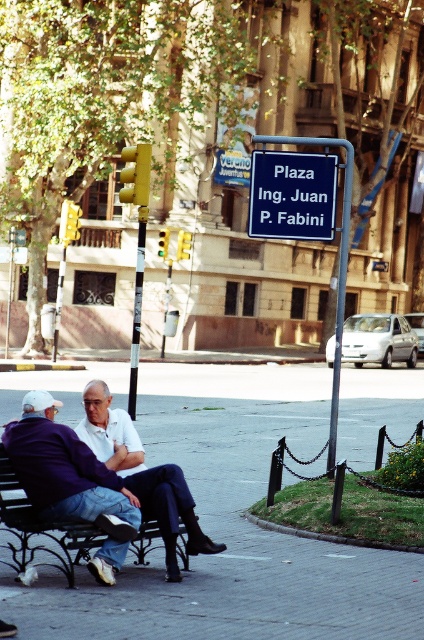
Question: Which object is the closest to the gray concrete pavement at center?

Choices:
 (A) white matte shirt at center
 (B) black wrought iron bench at center
 (C) blue plastic sign at center

Answer: (B)

Question: Which object is the farthest from the white matte shirt at center?

Choices:
 (A) gray concrete pavement at center
 (B) black wrought iron bench at center
 (C) blue plastic sign at center

Answer: (A)

Question: Which of the following is the farthest from the observer?

Choices:
 (A) tap(5, 456)
 (B) tap(272, 170)

Answer: (B)

Question: Can you confirm if gray concrete pavement at center is positioned below blue plastic sign at center?

Choices:
 (A) no
 (B) yes

Answer: (B)

Question: Is gray concrete pavement at center smaller than white matte shirt at center?

Choices:
 (A) no
 (B) yes

Answer: (A)

Question: From the image, what is the correct spatial relationship of white matte shirt at center in relation to blue plastic sign at center?

Choices:
 (A) right
 (B) left

Answer: (B)